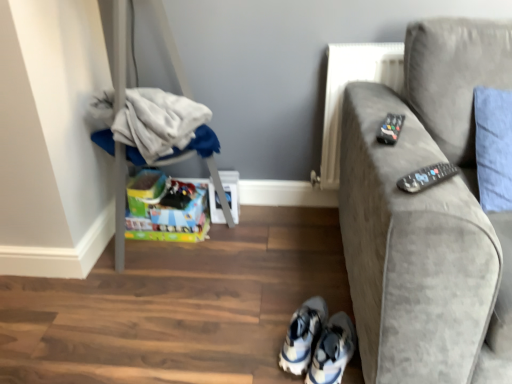
Question: From a real-world perspective, is white fabric at left physically above black plastic remote at right, arranged as the 1th remote when ordered from the bottom?

Choices:
 (A) no
 (B) yes

Answer: (A)

Question: Does white fabric at left have a smaller size compared to black plastic remote at right, which is the 1th remote from front to back?

Choices:
 (A) no
 (B) yes

Answer: (A)

Question: From the image's perspective, is white fabric at left over black plastic remote at right, arranged as the 1th remote when ordered from the bottom?

Choices:
 (A) no
 (B) yes

Answer: (B)

Question: Is white fabric at left in contact with black plastic remote at right, the second remote from the top?

Choices:
 (A) no
 (B) yes

Answer: (A)

Question: Is there a large distance between white fabric at left and black plastic remote at right, the second remote from the top?

Choices:
 (A) no
 (B) yes

Answer: (A)

Question: Considering the positions of white fabric at left and white mesh sneakers at lower center, the first footwear from the left, in the image, is white fabric at left wider or thinner than white mesh sneakers at lower center, the first footwear from the left,?

Choices:
 (A) thin
 (B) wide

Answer: (B)

Question: Considering the relative positions of white fabric at left and white mesh sneakers at lower center, the first footwear from the left, in the image provided, is white fabric at left to the left or to the right of white mesh sneakers at lower center, the first footwear from the left,?

Choices:
 (A) left
 (B) right

Answer: (A)

Question: Does point (157, 97) appear closer or farther from the camera than point (294, 372)?

Choices:
 (A) farther
 (B) closer

Answer: (A)

Question: Relative to white mesh sneakers at lower center, the first footwear from the left, is white fabric at left in front or behind?

Choices:
 (A) behind
 (B) front

Answer: (A)

Question: From a real-world perspective, is white mesh sneakers at lower center, the first footwear from the left, positioned above or below white fabric at left?

Choices:
 (A) below
 (B) above

Answer: (A)

Question: From the image's perspective, relative to white fabric at left, is white mesh sneakers at lower center, the first footwear from the left, above or below?

Choices:
 (A) above
 (B) below

Answer: (B)

Question: From their relative heights in the image, would you say white mesh sneakers at lower center, the first footwear from the left, is taller or shorter than white fabric at left?

Choices:
 (A) tall
 (B) short

Answer: (B)

Question: Is white mesh sneakers at lower center, the first footwear from the left, situated inside white fabric at left or outside?

Choices:
 (A) outside
 (B) inside

Answer: (A)

Question: Looking at the image, does black plastic remote at right, arranged as the 1th remote when ordered from the bottom, seem bigger or smaller compared to white mesh sneakers at lower center, which is counted as the 2th footwear, starting from the right?

Choices:
 (A) small
 (B) big

Answer: (A)

Question: From a real-world perspective, is black plastic remote at right, the second remote from the top, above or below white mesh sneakers at lower center, which is counted as the 2th footwear, starting from the right?

Choices:
 (A) above
 (B) below

Answer: (A)